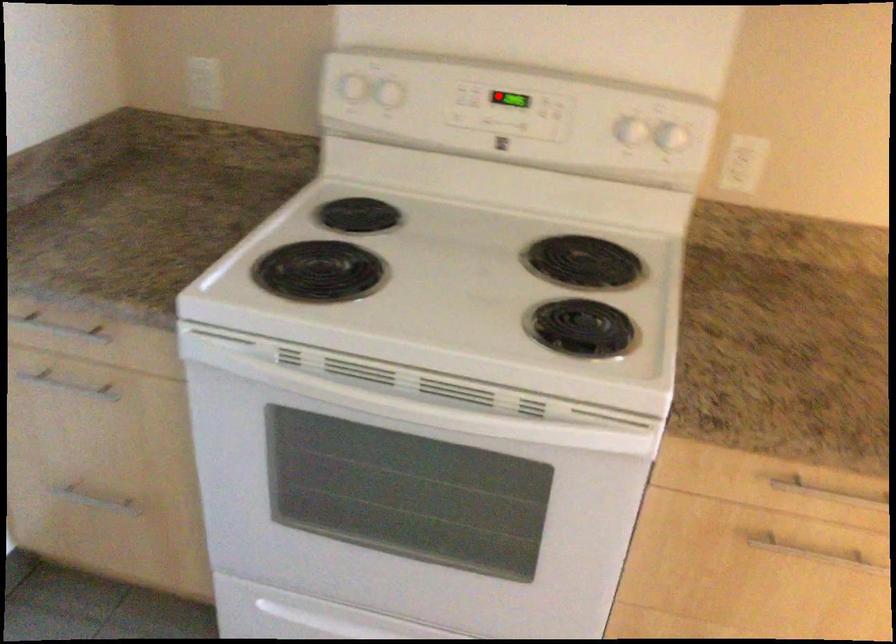
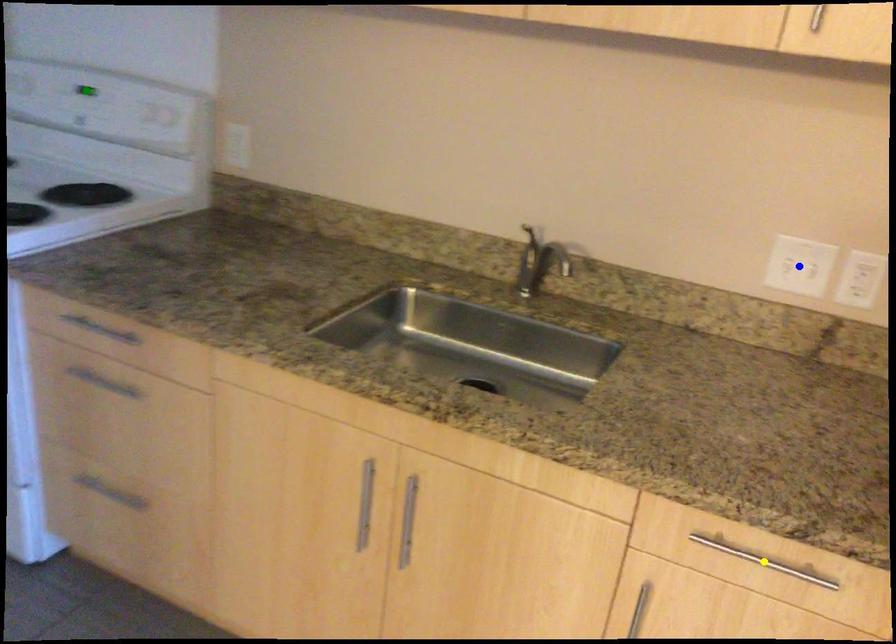
Question: I am providing you with two images of the same scene from different viewpoints. A red point is marked on the first image. You are given multiple points on the second image. Can you choose the point in image 2 that corresponds to the point in image 1?

Choices:
 (A) green point
 (B) yellow point
 (C) blue point

Answer: (A)